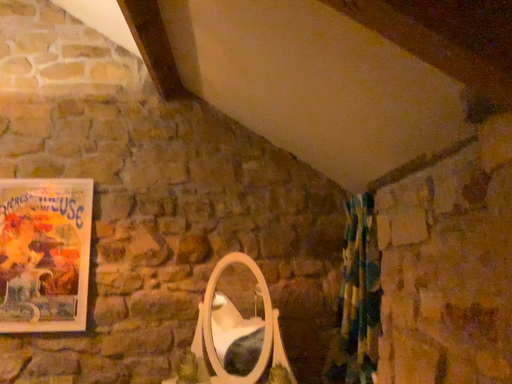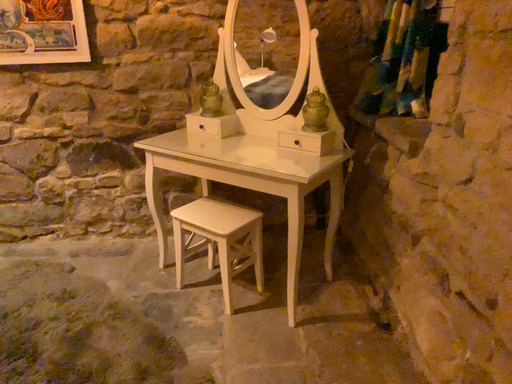
Question: How did the camera likely rotate when shooting the video?

Choices:
 (A) rotated downward
 (B) rotated upward

Answer: (A)